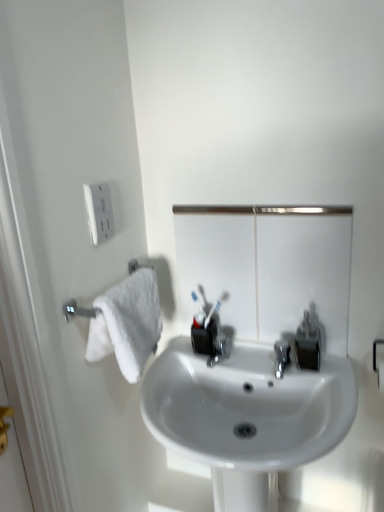
Question: Is metallic reflective mirror at center not within matte black soap dispenser at center right?

Choices:
 (A) no
 (B) yes

Answer: (B)

Question: Is metallic reflective mirror at center smaller than matte black soap dispenser at center right?

Choices:
 (A) no
 (B) yes

Answer: (A)

Question: Is the position of metallic reflective mirror at center more distant than that of matte black soap dispenser at center right?

Choices:
 (A) no
 (B) yes

Answer: (A)

Question: Is metallic reflective mirror at center in contact with matte black soap dispenser at center right?

Choices:
 (A) yes
 (B) no

Answer: (B)

Question: Can you confirm if metallic reflective mirror at center is wider than matte black soap dispenser at center right?

Choices:
 (A) yes
 (B) no

Answer: (B)

Question: Is metallic reflective mirror at center thinner than matte black soap dispenser at center right?

Choices:
 (A) yes
 (B) no

Answer: (A)

Question: From the image's perspective, does matte black soap dispenser at center right appear higher than white glossy sink at center?

Choices:
 (A) yes
 (B) no

Answer: (A)

Question: Does matte black soap dispenser at center right have a lesser height compared to white glossy sink at center?

Choices:
 (A) yes
 (B) no

Answer: (A)

Question: Is matte black soap dispenser at center right beside white glossy sink at center?

Choices:
 (A) yes
 (B) no

Answer: (B)

Question: Is white glossy sink at center surrounded by matte black soap dispenser at center right?

Choices:
 (A) yes
 (B) no

Answer: (B)

Question: Is matte black soap dispenser at center right at the left side of white glossy sink at center?

Choices:
 (A) no
 (B) yes

Answer: (A)

Question: Is the depth of matte black soap dispenser at center right less than that of white glossy sink at center?

Choices:
 (A) no
 (B) yes

Answer: (A)

Question: Is matte black soap dispenser at center right in contact with metallic reflective mirror at center?

Choices:
 (A) yes
 (B) no

Answer: (B)